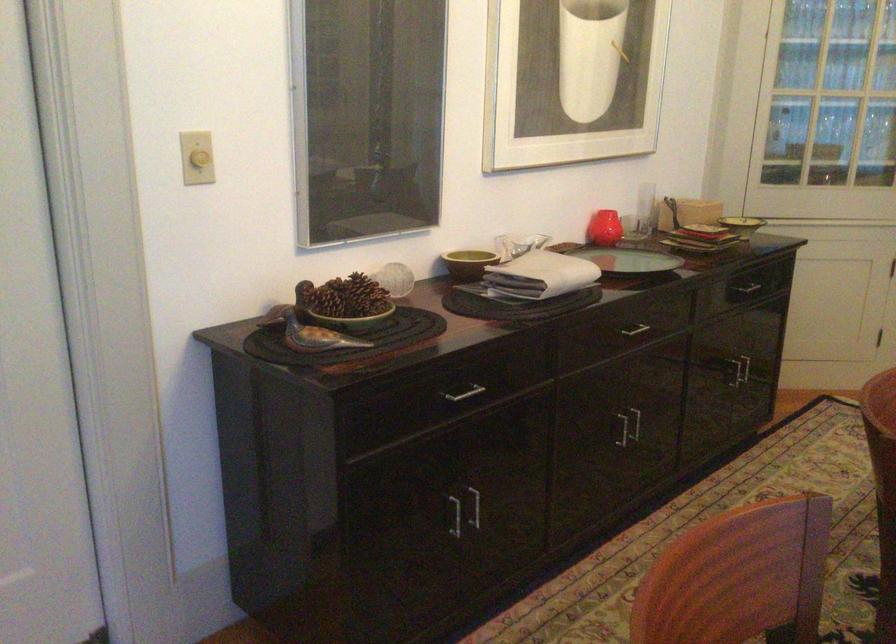
Locate an element on the screen. clear drinking glass is located at coordinates (645, 207).